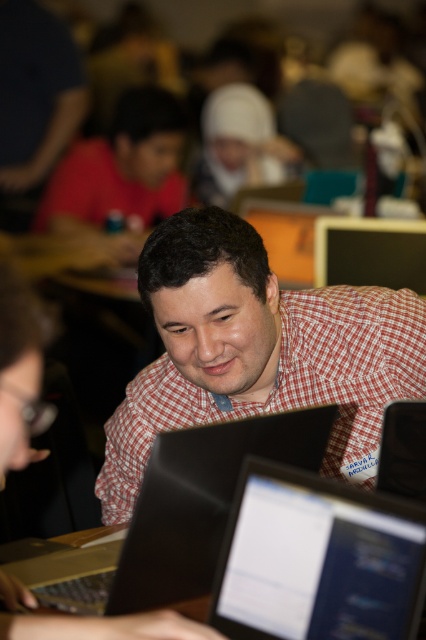
You are standing in the classroom and want to see both the matte black laptop at center and the matte black monitor at upper center. Which one do you need to look closer to see in more detail?

The matte black laptop at center is closer to the viewer than the matte black monitor at upper center, so you need to look closer to the matte black laptop at center to see it in more detail.